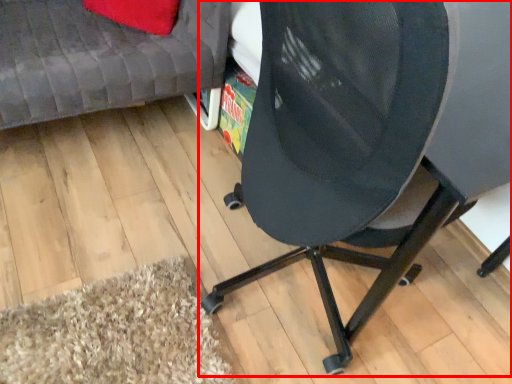
Question: From the image's perspective, considering the relative positions of chair (annotated by the red box) and furniture in the image provided, where is chair (annotated by the red box) located with respect to the staircase?

Choices:
 (A) above
 (B) below

Answer: (B)